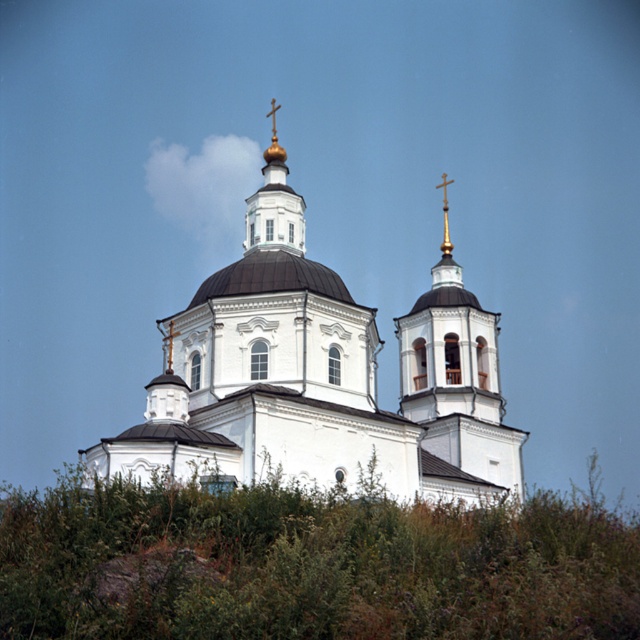
Question: Is green leafy bush at center to the left of gold metallic cross at upper center from the viewer's perspective?

Choices:
 (A) yes
 (B) no

Answer: (A)

Question: Where is green leafy bush at center located in relation to gold metallic cross at upper center in the image?

Choices:
 (A) above
 (B) below

Answer: (B)

Question: Among these objects, which one is nearest to the camera?

Choices:
 (A) green leafy bush at center
 (B) gold metallic cross at upper center
 (C) white smooth church at center

Answer: (A)

Question: Can you confirm if green leafy bush at center is positioned below white smooth church at center?

Choices:
 (A) yes
 (B) no

Answer: (A)

Question: Which point appears farthest from the camera in this image?

Choices:
 (A) (442, 196)
 (B) (417, 394)
 (C) (595, 536)

Answer: (A)

Question: Which object is closer to the camera taking this photo?

Choices:
 (A) gold metallic cross at upper center
 (B) white smooth church at center
 (C) green leafy bush at center

Answer: (C)